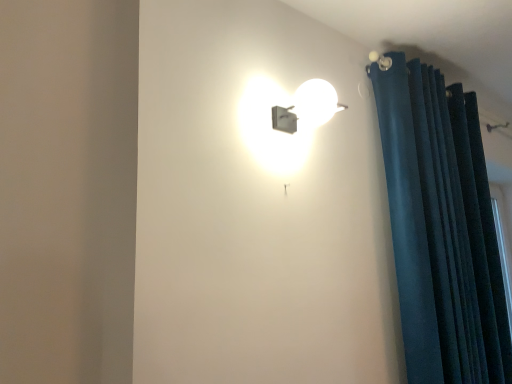
Question: Are dark blue velvet curtain at right and matte white lamp at upper center making contact?

Choices:
 (A) no
 (B) yes

Answer: (A)

Question: Is dark blue velvet curtain at right aimed at matte white lamp at upper center?

Choices:
 (A) no
 (B) yes

Answer: (A)

Question: Can matte white lamp at upper center be found inside dark blue velvet curtain at right?

Choices:
 (A) yes
 (B) no

Answer: (B)

Question: Can you confirm if dark blue velvet curtain at right is positioned to the right of matte white lamp at upper center?

Choices:
 (A) yes
 (B) no

Answer: (A)

Question: From a real-world perspective, is dark blue velvet curtain at right located beneath matte white lamp at upper center?

Choices:
 (A) yes
 (B) no

Answer: (A)

Question: From a real-world perspective, is dark blue velvet curtain at right physically above matte white lamp at upper center?

Choices:
 (A) no
 (B) yes

Answer: (A)

Question: Does matte white lamp at upper center have a greater width compared to dark blue velvet curtain at right?

Choices:
 (A) no
 (B) yes

Answer: (B)

Question: Can you confirm if matte white lamp at upper center is thinner than dark blue velvet curtain at right?

Choices:
 (A) no
 (B) yes

Answer: (A)

Question: Are matte white lamp at upper center and dark blue velvet curtain at right located far from each other?

Choices:
 (A) yes
 (B) no

Answer: (B)

Question: Is matte white lamp at upper center positioned beyond the bounds of dark blue velvet curtain at right?

Choices:
 (A) no
 (B) yes

Answer: (B)

Question: From a real-world perspective, is matte white lamp at upper center physically above dark blue velvet curtain at right?

Choices:
 (A) no
 (B) yes

Answer: (B)

Question: Is matte white lamp at upper center oriented towards dark blue velvet curtain at right?

Choices:
 (A) no
 (B) yes

Answer: (A)

Question: From the image's perspective, relative to matte white lamp at upper center, is dark blue velvet curtain at right above or below?

Choices:
 (A) above
 (B) below

Answer: (B)